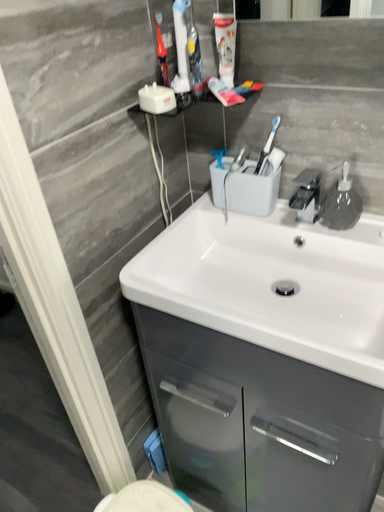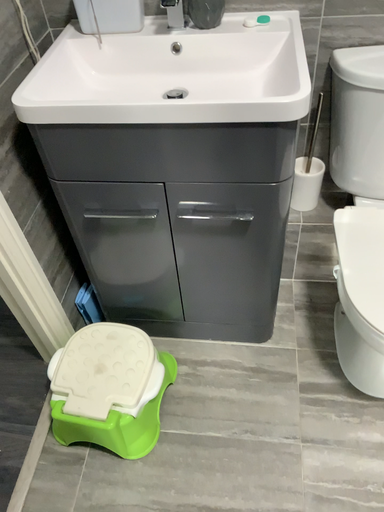
Question: How did the camera likely rotate when shooting the video?

Choices:
 (A) rotated left
 (B) rotated right

Answer: (B)